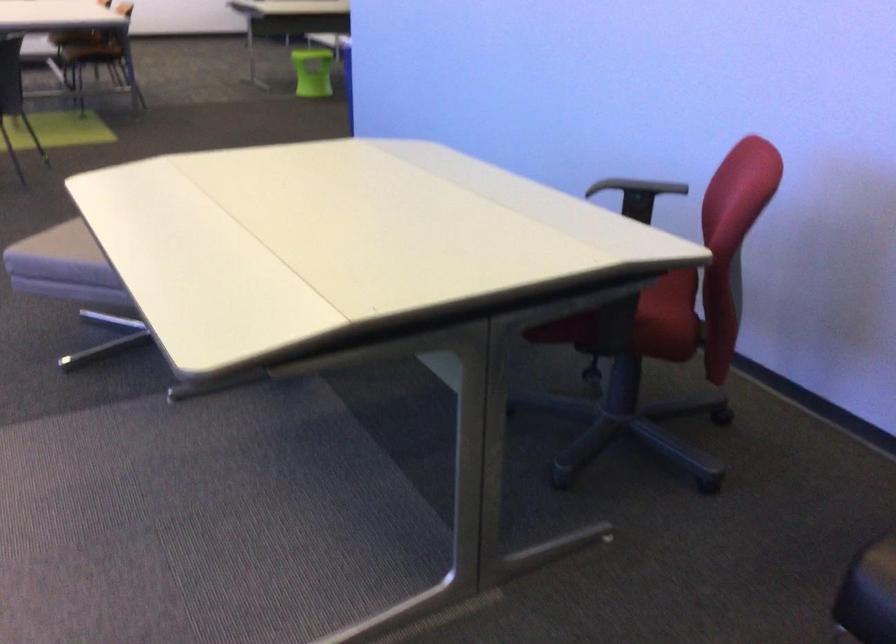
Where is `black chair armrest`? black chair armrest is located at coordinates (636, 185).